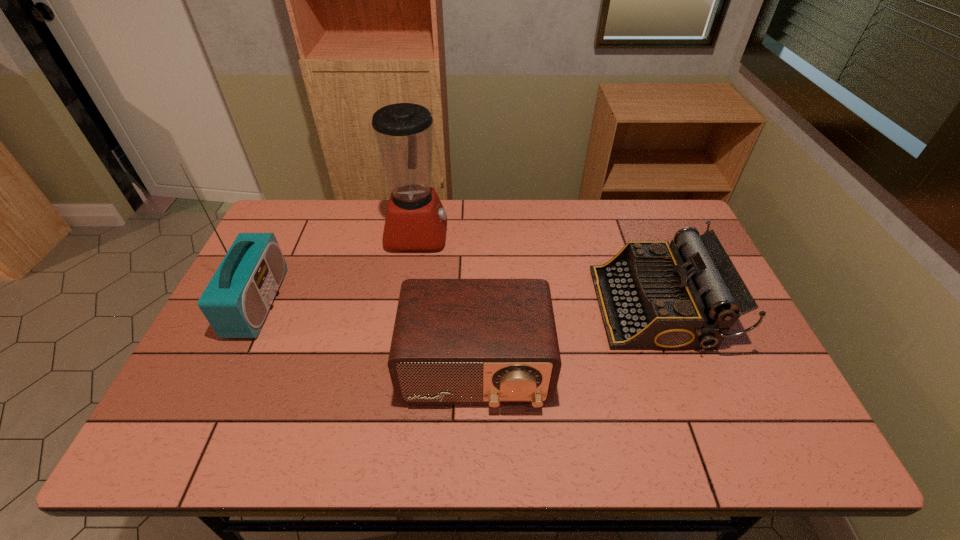
Where is `blender`? blender is located at coordinates (416, 220).

I want to click on the left radio receiver, so click(x=236, y=301).

The image size is (960, 540). I want to click on the taller radio receiver, so click(x=236, y=301).

I want to click on the shorter radio receiver, so click(x=493, y=342).

This screenshot has height=540, width=960. I want to click on typewriter, so click(653, 295).

Identify the location of vacant point located 0.230m on the front of the blender near the controls. (516, 233).

Where is `vacant space located 0.110m on the front panel of the taller radio receiver`? This screenshot has height=540, width=960. vacant space located 0.110m on the front panel of the taller radio receiver is located at coordinates (317, 302).

Find the location of `vacant space positioned on the front panel of the right radio receiver`. vacant space positioned on the front panel of the right radio receiver is located at coordinates (475, 436).

Locate an element on the screen. The width and height of the screenshot is (960, 540). free space located 0.280m on the keyboard of the typewriter is located at coordinates (499, 307).

This screenshot has width=960, height=540. In order to click on vacant space located on the keyboard of the typewriter in this screenshot , I will do `click(460, 307)`.